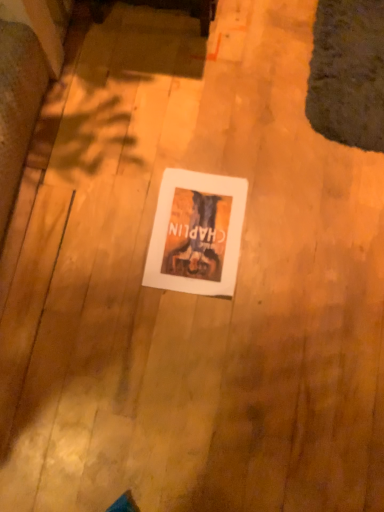
The width and height of the screenshot is (384, 512). What are the coordinates of `vacant area that is situated to the right of white paper poster at center` in the screenshot? It's located at (288, 241).